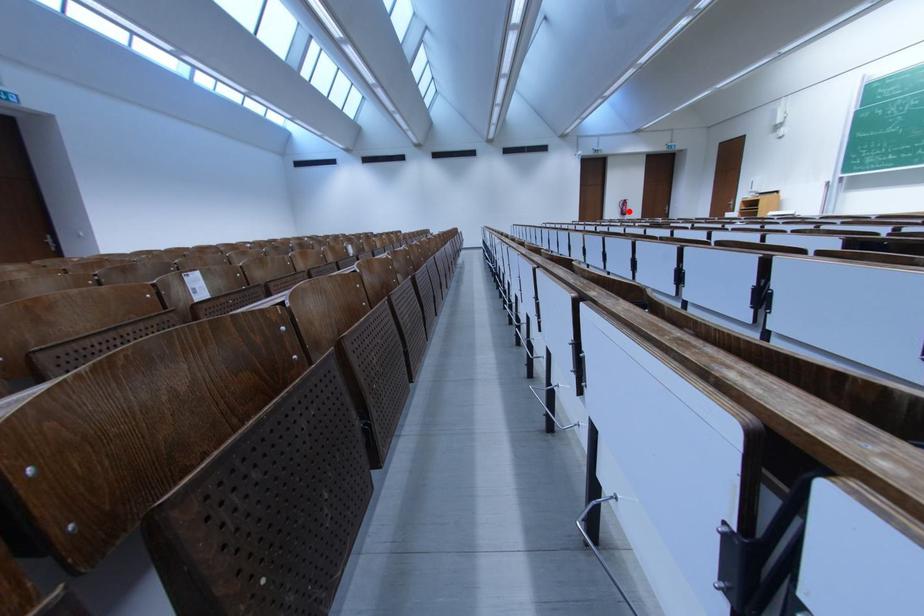
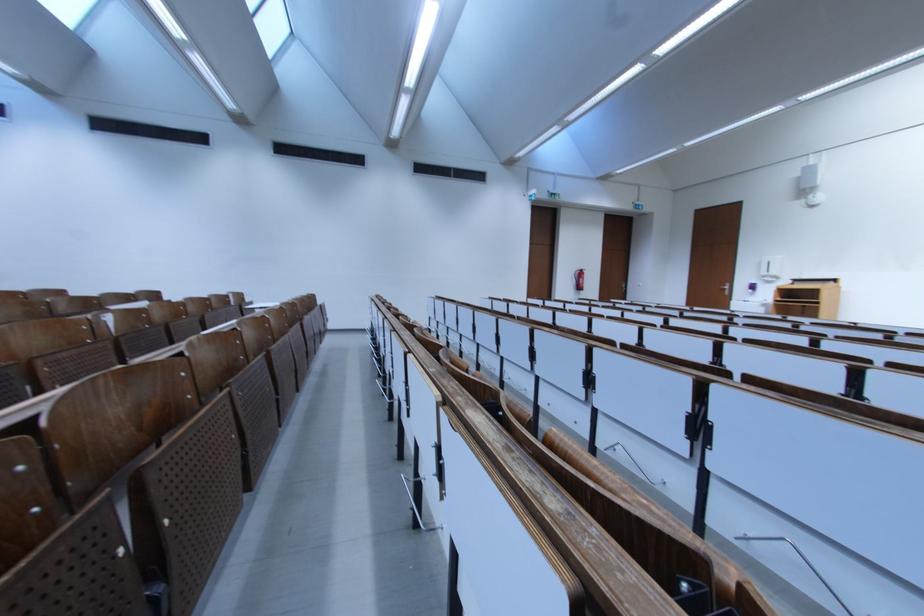
Question: I am providing you with two images of the same scene from different viewpoints. Given a red point in image1, look at the same physical point in image2. Is it:

Choices:
 (A) Closer to the viewpoint
 (B) Farther from the viewpoint

Answer: (A)